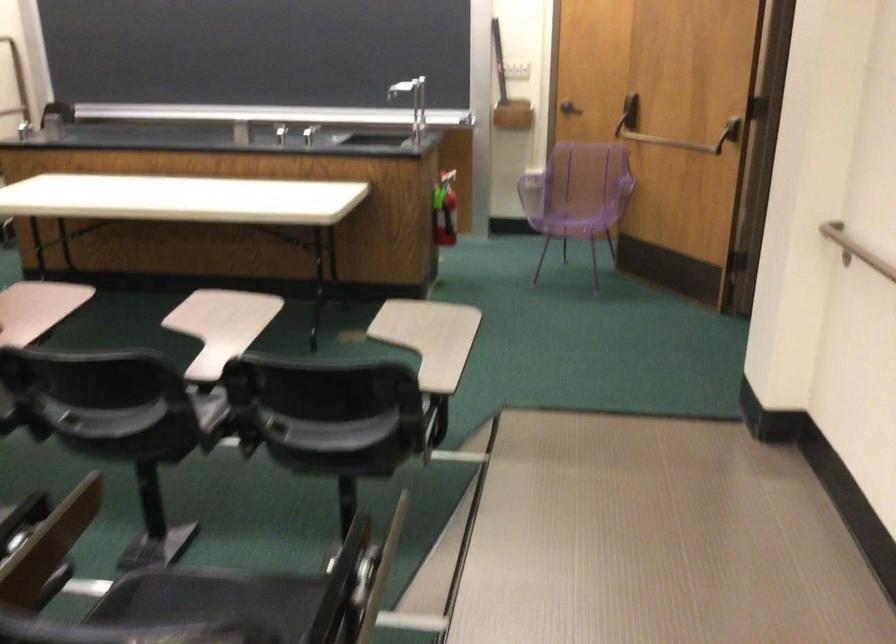
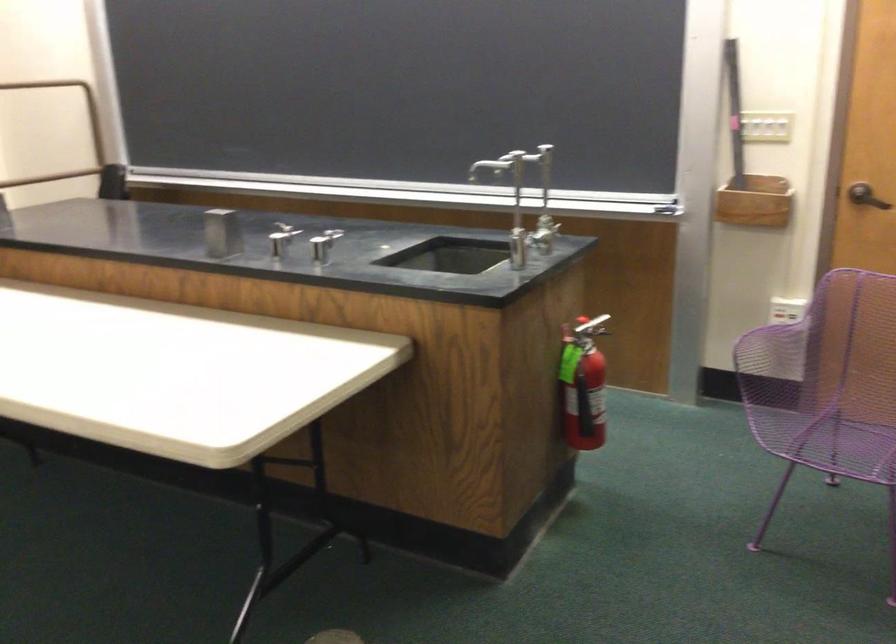
In the second image, find the point that corresponds to point 573,100 in the first image.

(866, 196)